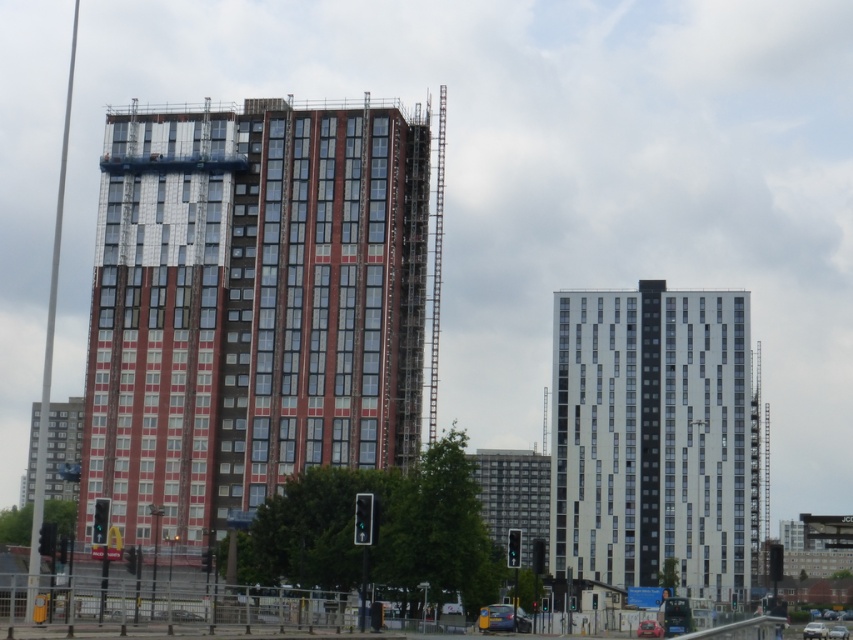
You are a drone operator tasked with capturing aerial footage of the two points in the urban scene. The first point is at coordinates point (x=120, y=189) and the second is at point (x=737, y=600). Which point should you film first if you want to start with the one that is closer to the camera?

Point (x=120, y=189) is closer to the camera than point (x=737, y=600), so you should film point 0.298, 0.293 first.

You are a drone operator trying to capture aerial footage of the two buildings. Since the red brick building at center and the white glass building at center are both in your camera frame, which one would appear larger in the footage?

The red brick building at center appears larger in the footage because it is in front of the white glass building at center, making it closer to the camera.

You are a construction worker needing to transport materials between the two buildings. Given that your crane has a maximum reach of 60 meters, can you safely move materials from the red brick building at center to the white glass building at center?

The distance between the red brick building at center and the white glass building at center is 59.68 meters, which is within the crane s 60 meter maximum reach. Therefore, the materials can be safely transported between them.